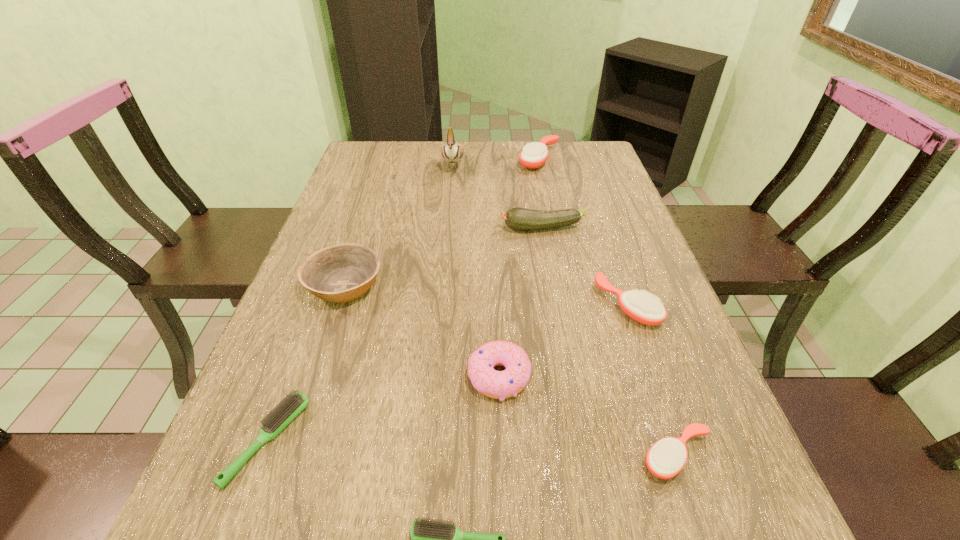
I want to click on free space at the right edge of the desktop, so click(696, 503).

Where is `vacant space at the far left corner of the desktop`? vacant space at the far left corner of the desktop is located at coordinates (401, 150).

Where is `free space between the second smallest orange hairbrush and the bird`? This screenshot has width=960, height=540. free space between the second smallest orange hairbrush and the bird is located at coordinates (540, 235).

This screenshot has width=960, height=540. Identify the location of unoccupied area between the left light hairbrush and the fourth shortest hairbrush. (447, 373).

This screenshot has height=540, width=960. Find the location of `empty space between the second biggest orange hairbrush and the farthest hairbrush`. empty space between the second biggest orange hairbrush and the farthest hairbrush is located at coordinates (583, 232).

The image size is (960, 540). In order to click on blank region between the third farthest object and the fourth tallest hairbrush in this screenshot , I will do `click(404, 335)`.

Locate an element on the screen. The height and width of the screenshot is (540, 960). empty space that is in between the second shortest hairbrush and the green zucchini is located at coordinates (404, 335).

Where is `free space between the tallest object and the third farthest object`? This screenshot has height=540, width=960. free space between the tallest object and the third farthest object is located at coordinates (497, 197).

Identify the location of free area in between the tallest object and the bowl. (399, 225).

Find the location of a particular element. The width and height of the screenshot is (960, 540). free area in between the seventh nearest object and the second farthest hairbrush is located at coordinates (584, 267).